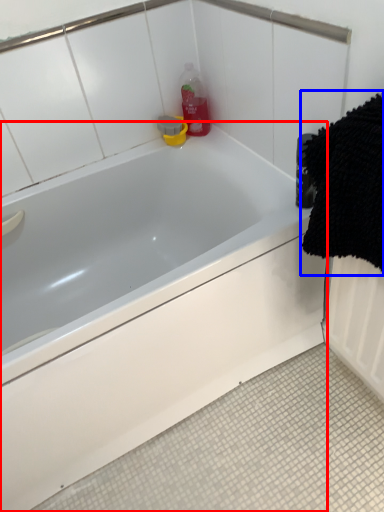
Question: Which point is further to the camera, bathtub (highlighted by a red box) or bath towel (highlighted by a blue box)?

Choices:
 (A) bathtub
 (B) bath towel

Answer: (A)